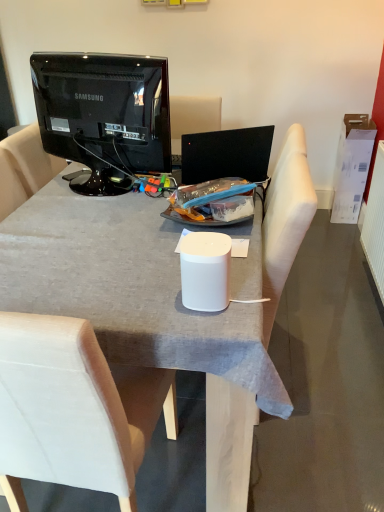
Question: Is white fabric armchair at center not close to white fabric chair at center?

Choices:
 (A) no
 (B) yes

Answer: (A)

Question: Is white fabric armchair at center further to camera compared to white fabric chair at center?

Choices:
 (A) no
 (B) yes

Answer: (B)

Question: Is white fabric armchair at center at the left side of white fabric chair at center?

Choices:
 (A) yes
 (B) no

Answer: (B)

Question: Does white fabric armchair at center have a greater height compared to white fabric chair at center?

Choices:
 (A) yes
 (B) no

Answer: (A)

Question: Can you confirm if white fabric armchair at center is wider than white fabric chair at center?

Choices:
 (A) yes
 (B) no

Answer: (A)

Question: Is white cardboard box at right bigger or smaller than white matte desk at center?

Choices:
 (A) small
 (B) big

Answer: (A)

Question: Considering the relative positions of white cardboard box at right and white matte desk at center in the image provided, is white cardboard box at right to the left or to the right of white matte desk at center?

Choices:
 (A) left
 (B) right

Answer: (B)

Question: Considering the positions of white cardboard box at right and white matte desk at center in the image, is white cardboard box at right taller or shorter than white matte desk at center?

Choices:
 (A) tall
 (B) short

Answer: (B)

Question: Considering the positions of white cardboard box at right and white matte desk at center in the image, is white cardboard box at right wider or thinner than white matte desk at center?

Choices:
 (A) thin
 (B) wide

Answer: (A)

Question: From the image's perspective, is white matte desk at center positioned above or below white fabric armchair at center?

Choices:
 (A) below
 (B) above

Answer: (A)

Question: In the image, is white matte desk at center positioned in front of or behind white fabric armchair at center?

Choices:
 (A) behind
 (B) front

Answer: (B)

Question: Considering the positions of white matte desk at center and white fabric armchair at center in the image, is white matte desk at center bigger or smaller than white fabric armchair at center?

Choices:
 (A) big
 (B) small

Answer: (A)

Question: From a real-world perspective, is white matte desk at center physically located above or below white fabric armchair at center?

Choices:
 (A) below
 (B) above

Answer: (A)

Question: Looking at the image, does white fabric chair at center seem bigger or smaller compared to white cardboard box at right?

Choices:
 (A) small
 (B) big

Answer: (B)

Question: Considering the positions of white fabric chair at center and white cardboard box at right in the image, is white fabric chair at center taller or shorter than white cardboard box at right?

Choices:
 (A) tall
 (B) short

Answer: (A)